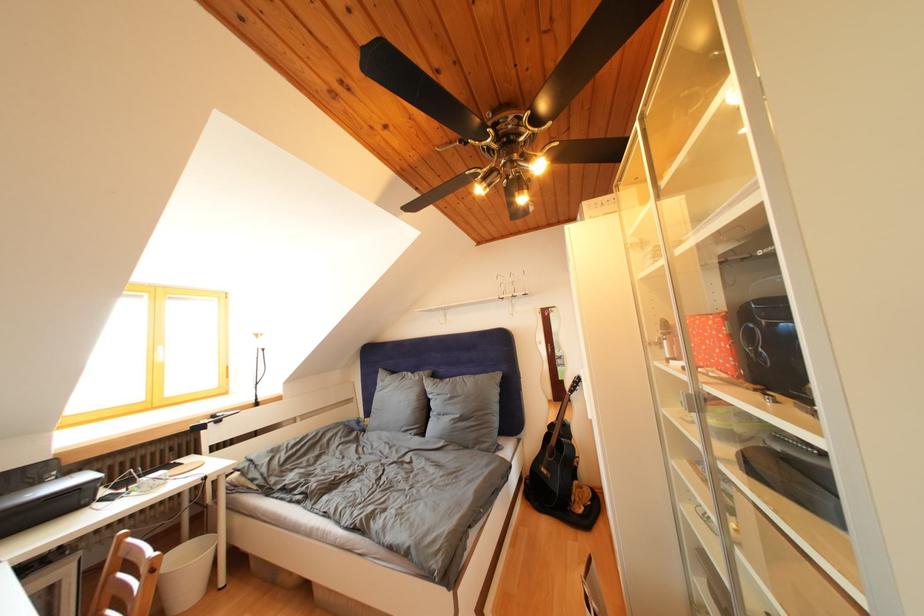
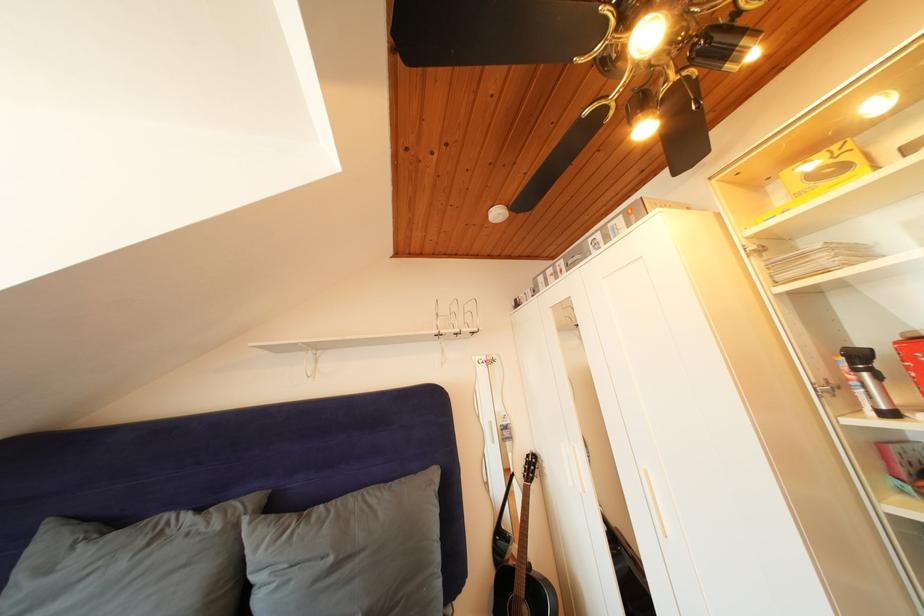
In the second image, find the point that corresponds to [426,383] in the first image.

(225, 531)